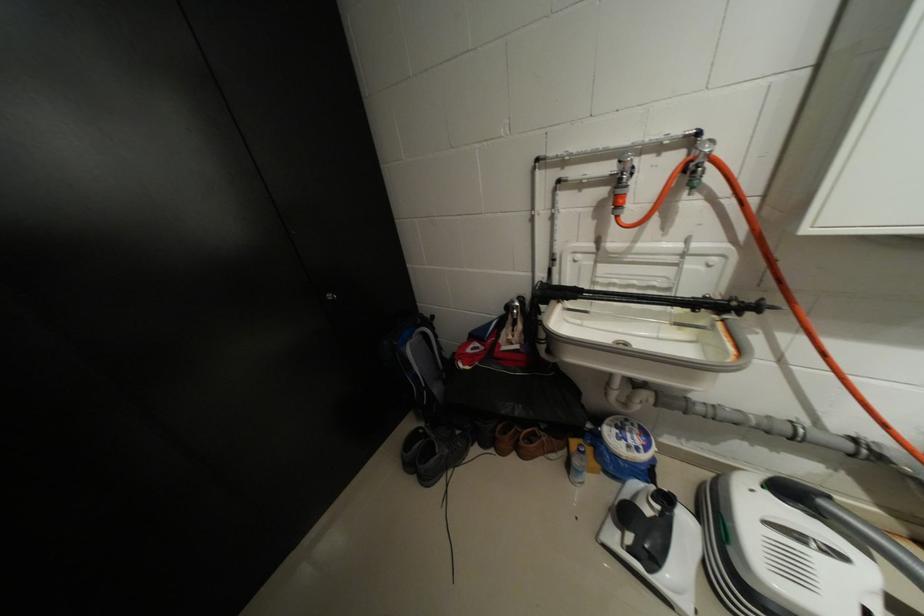
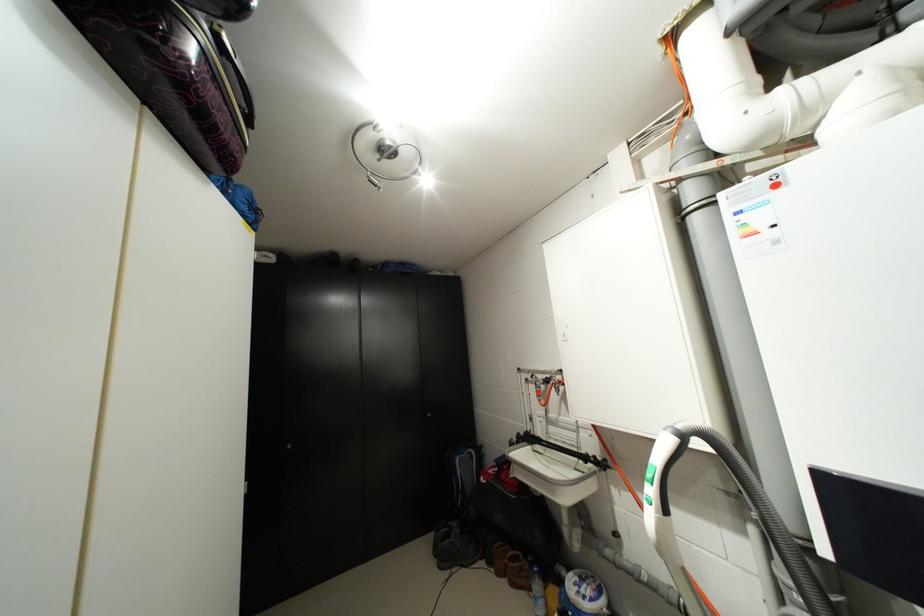
In the second image, find the point that corresponds to point 464,459 in the first image.

(473, 562)